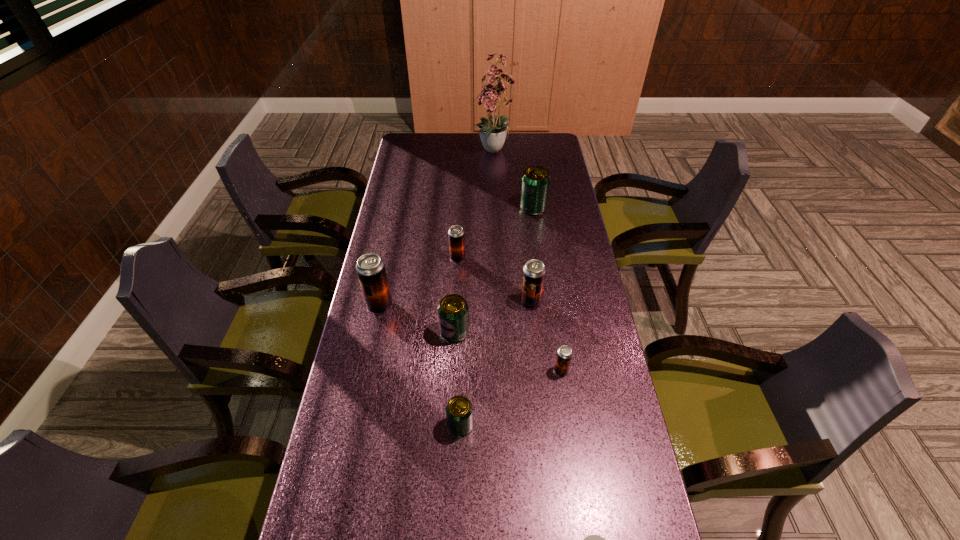
Locate an element on the screen. Image resolution: width=960 pixels, height=540 pixels. free space between the nearest green beer can and the rightmost black beer can is located at coordinates (511, 398).

What are the coordinates of `empty space that is in between the tallest beer can and the farthest black beer can` in the screenshot? It's located at (419, 282).

At what (x,y) coordinates should I click in order to perform the action: click on vacant region between the farthest object and the rightmost black beer can. Please return your answer as a coordinate pair (x, y). This screenshot has width=960, height=540. Looking at the image, I should click on (528, 261).

Where is `free area in between the second nearest green beer can and the second biggest black beer can`? The height and width of the screenshot is (540, 960). free area in between the second nearest green beer can and the second biggest black beer can is located at coordinates (492, 318).

Image resolution: width=960 pixels, height=540 pixels. I want to click on free space between the leftmost beer can and the rightmost black beer can, so click(470, 338).

Locate an element on the screen. The image size is (960, 540). free space between the sixth farthest beer can and the farthest object is located at coordinates (528, 261).

Locate an element on the screen. The image size is (960, 540). unoccupied position between the smallest green beer can and the fifth farthest beer can is located at coordinates (458, 379).

Find the location of a particular element. vacant region between the second black beer can from right to left and the farthest beer can is located at coordinates (532, 255).

Where is `object that is the fourth nearest to the nearest beer can`? object that is the fourth nearest to the nearest beer can is located at coordinates (533, 278).

The height and width of the screenshot is (540, 960). I want to click on the third closest object to the tallest beer can, so click(459, 411).